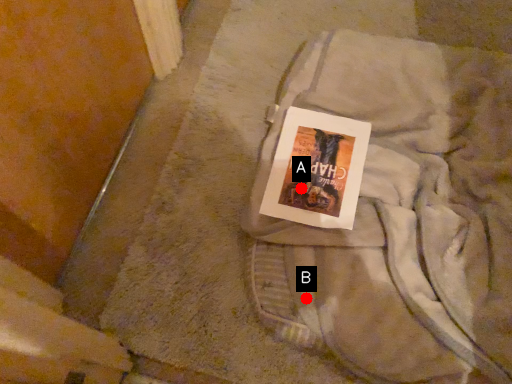
Question: Two points are circled on the image, labeled by A and B beside each circle. Among these points, which one is farthest from the camera?

Choices:
 (A) A is further
 (B) B is further

Answer: (A)